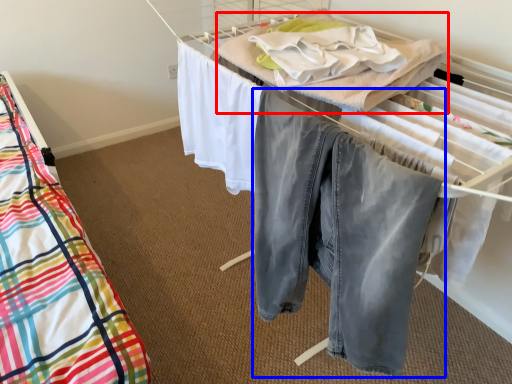
Question: Which point is closer to the camera, blanket (highlighted by a red box) or trousers (highlighted by a blue box)?

Choices:
 (A) blanket
 (B) trousers

Answer: (B)